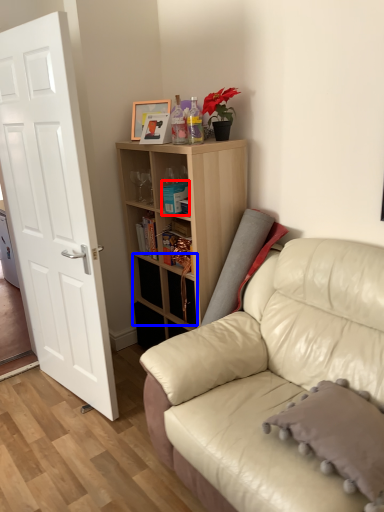
Question: Which object is further to the camera taking this photo, book (highlighted by a red box) or drawer (highlighted by a blue box)?

Choices:
 (A) book
 (B) drawer

Answer: (B)